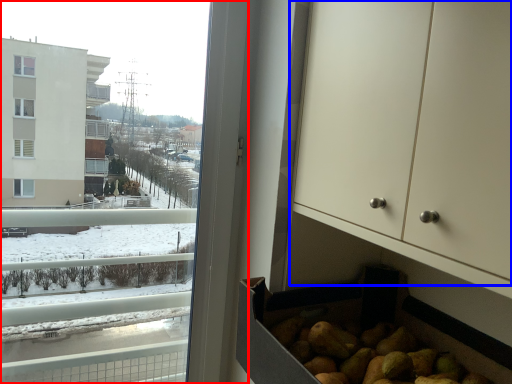
Question: Among these objects, which one is farthest to the camera, window (highlighted by a red box) or dresser (highlighted by a blue box)?

Choices:
 (A) window
 (B) dresser

Answer: (A)